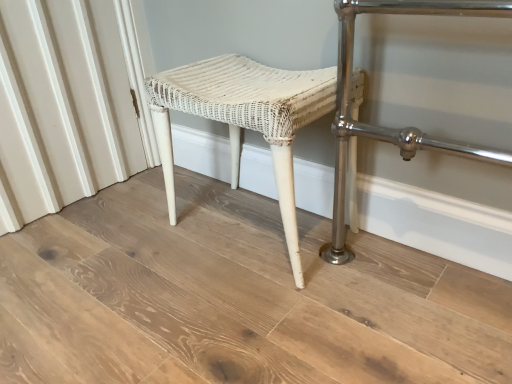
Identify the location of vacant location below white wicker stool at center (from a real-world perspective). (256, 226).